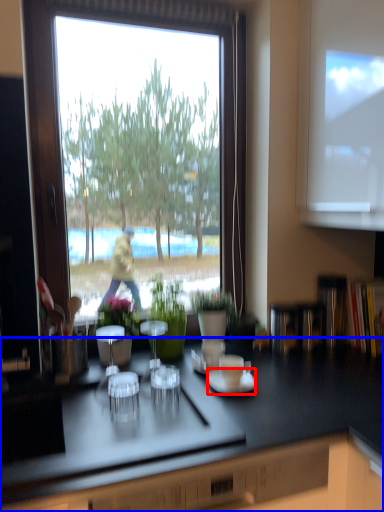
Question: Which object is further to the camera taking this photo, saucer (highlighted by a red box) or countertop (highlighted by a blue box)?

Choices:
 (A) saucer
 (B) countertop

Answer: (A)